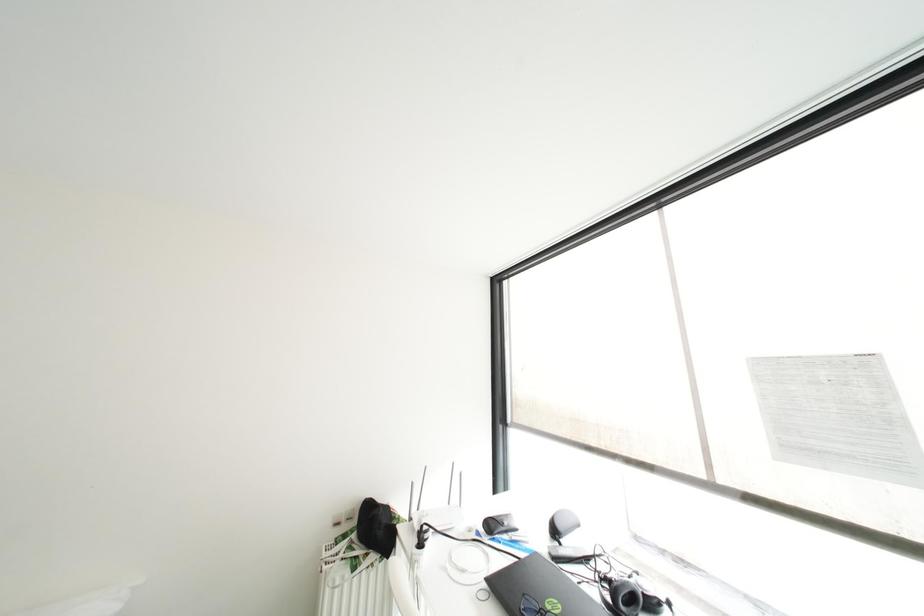
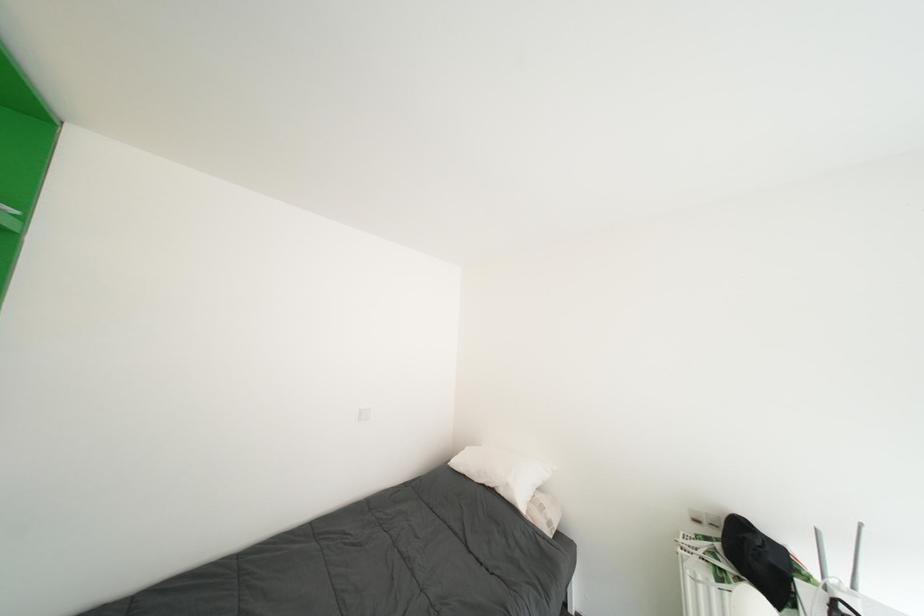
Question: The camera is either moving clockwise (left) or counter-clockwise (right) around the object. The first image is from the beginning of the video and the second image is from the end. Is the camera moving left or right when shooting the video?

Choices:
 (A) Left
 (B) Right

Answer: (B)